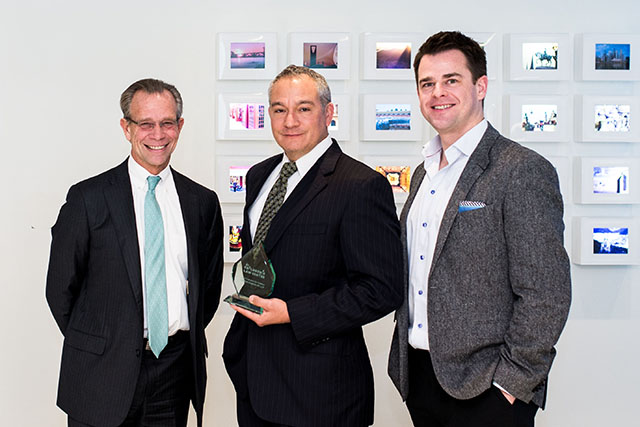
This screenshot has width=640, height=427. Find the location of `trophy`. trophy is located at coordinates (257, 267).